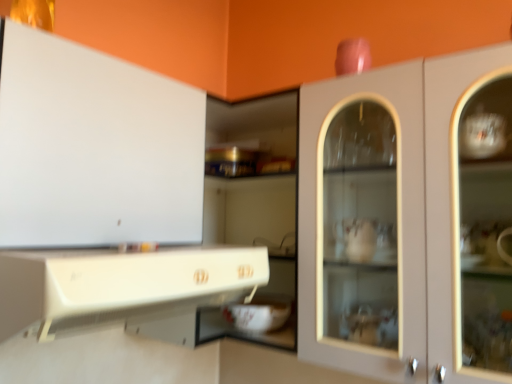
Question: Is matte white cabinet at center, the 1th cabinetry viewed from the right, to the left or to the right of white glossy cabinet at upper left, which appears as the first cabinetry when viewed from the left, in the image?

Choices:
 (A) right
 (B) left

Answer: (A)

Question: Is matte white cabinet at center, the 1th cabinetry viewed from the right, bigger or smaller than white glossy cabinet at upper left, the 3th cabinetry when ordered from right to left?

Choices:
 (A) big
 (B) small

Answer: (A)

Question: Considering the real-world distances, which object is farthest from the matte white cabinet at center, the 1th cabinetry viewed from the right?

Choices:
 (A) white glossy cabinet at upper left, the 3th cabinetry when ordered from right to left
 (B) white glossy cabinet at lower left, arranged as the 2th cabinetry when viewed from the right

Answer: (A)

Question: Considering the real-world distances, which object is farthest from the white glossy cabinet at upper left, the 3th cabinetry when ordered from right to left?

Choices:
 (A) matte white cabinet at center, arranged as the third cabinetry when viewed from the left
 (B) white glossy cabinet at lower left, which is the second cabinetry from left to right

Answer: (A)